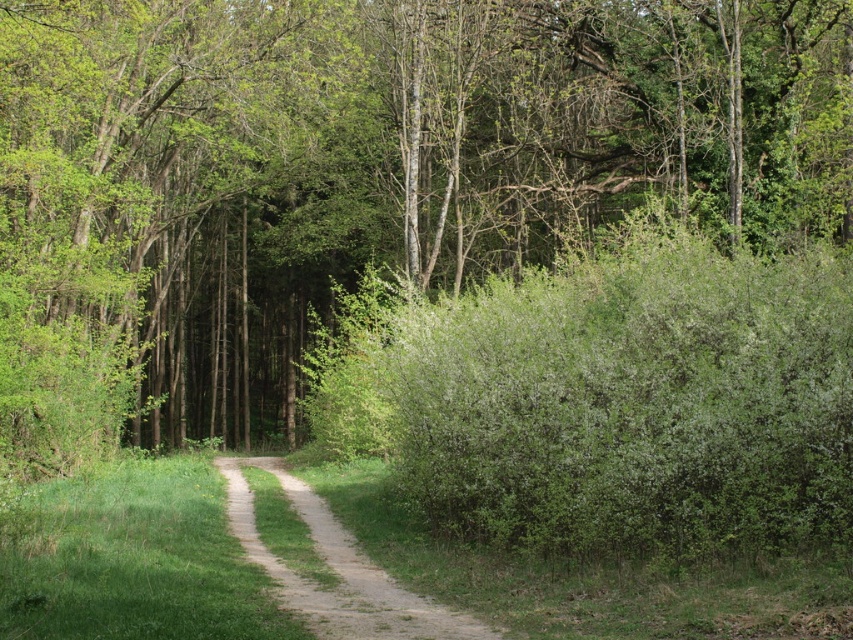
Does point (833, 486) come farther from viewer compared to point (363, 612)?

That is True.

Identify the location of green leafy bush at right. Image resolution: width=853 pixels, height=640 pixels. (610, 401).

The height and width of the screenshot is (640, 853). In order to click on green leafy bush at right in this screenshot , I will do `click(610, 401)`.